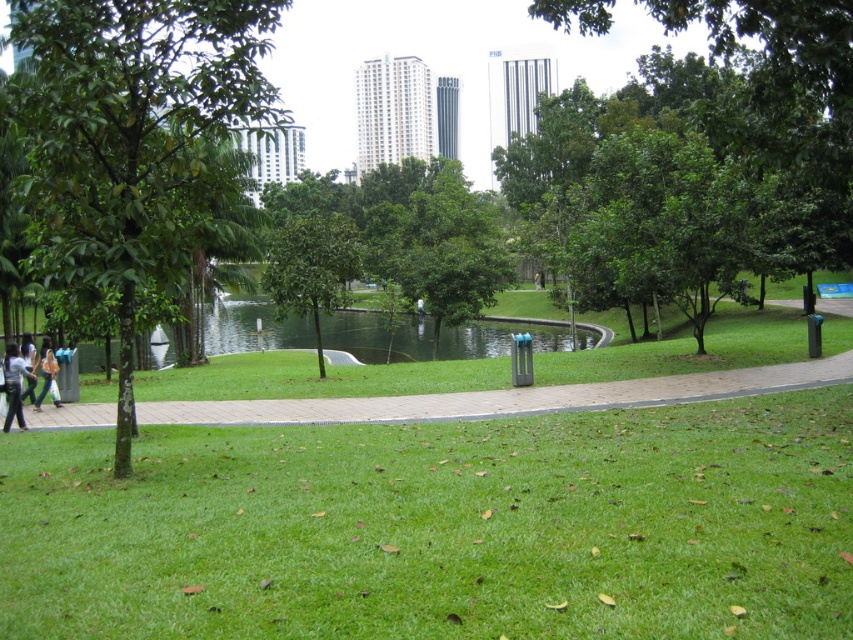
You are standing at the point marked as point [3,364] in the park. You want to take a photo of the entire park from your current position. Considering the distance between you and the camera, will the camera be able to capture the entire park in one shot?

The distance between point [3,364] and the camera is 14.50 meters. Whether the camera can capture the entire park depends on its field of view and zoom capabilities. Since the question does not provide specific details about the camera equipment, it is impossible to definitively answer if the entire park can be captured in one shot.

You are a photographer standing in the park and see the light blue shirt at lower left and the light brown leather jacket at lower left. Which clothing item is taller?

The light blue shirt at lower left is taller than the light brown leather jacket at lower left.